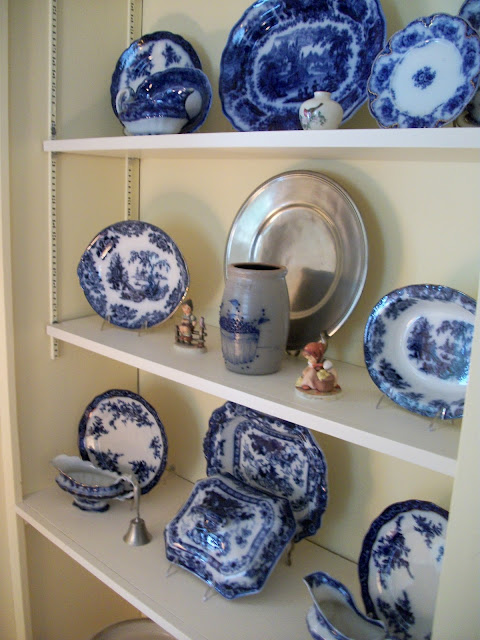
I want to click on large blue plate, so click(303, 56).